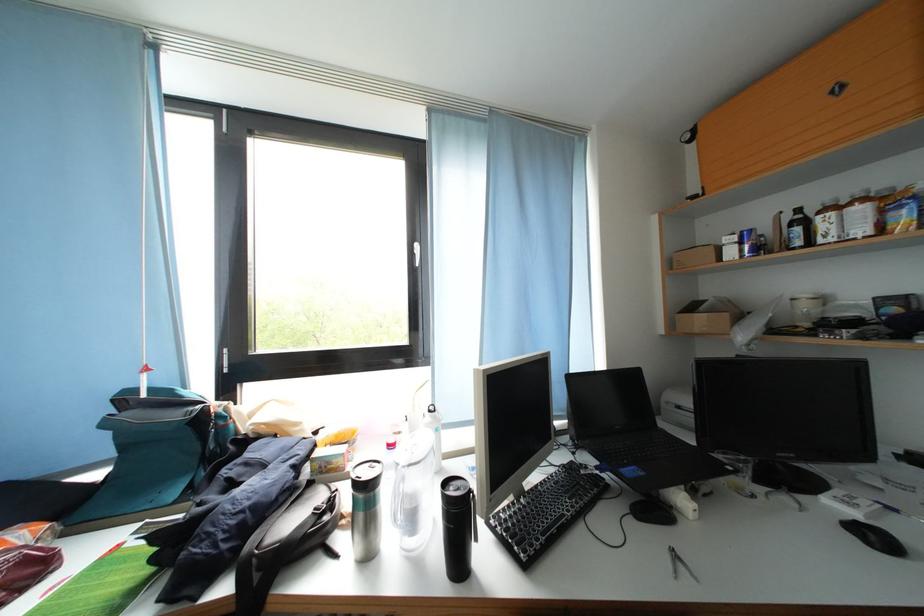
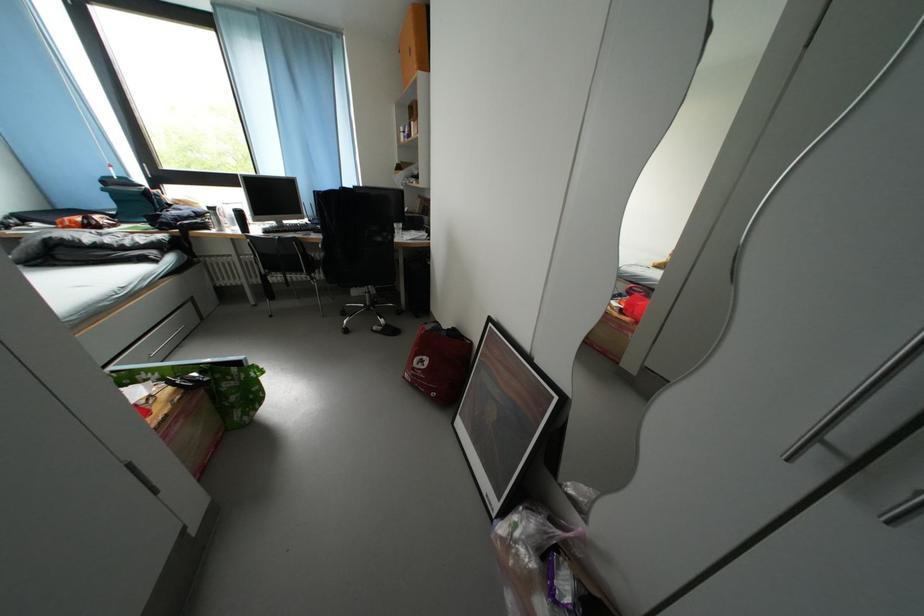
What movement of the cameraman would produce the second image?

The cameraman moved toward right, backward.